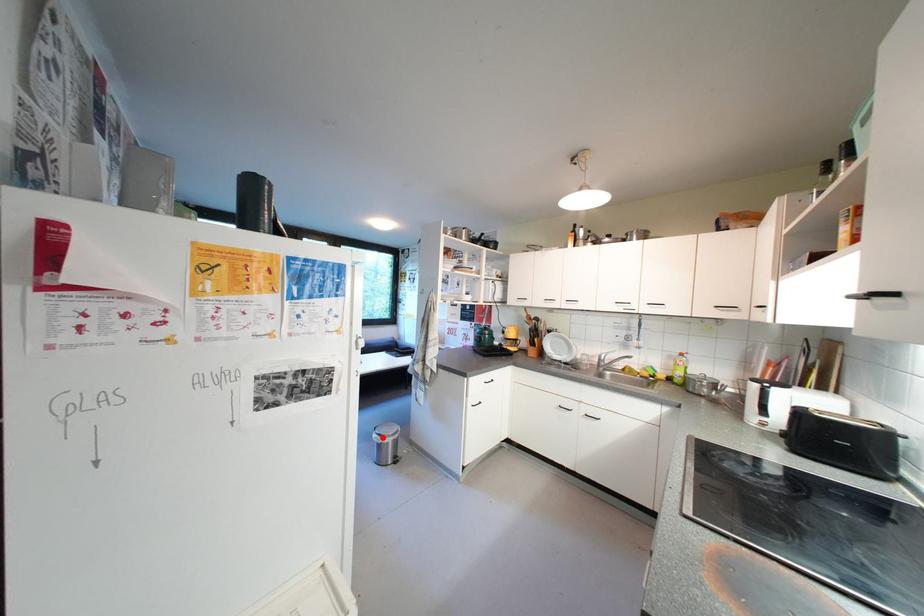
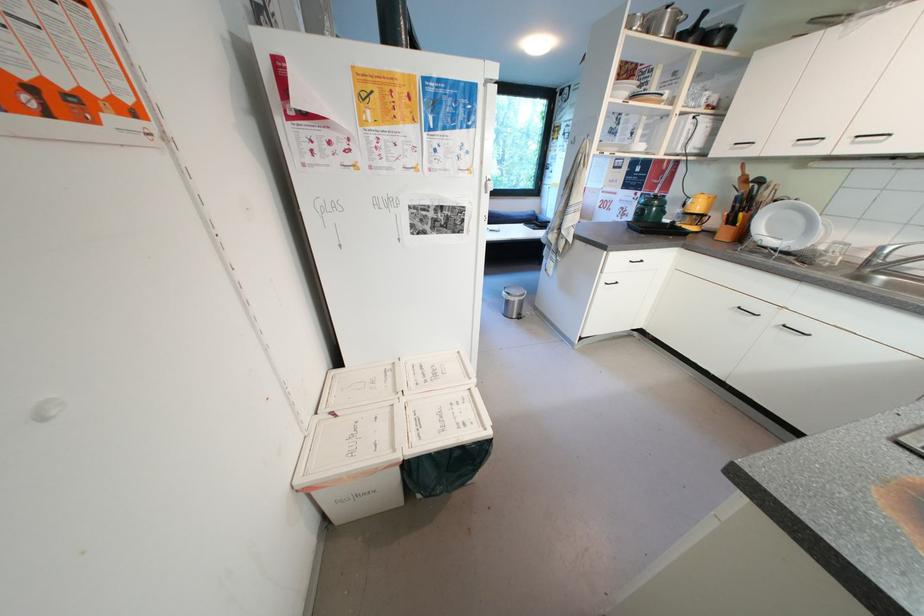
Question: A red point is marked in image1. In image2, is the corresponding 3D point closer to the camera or farther? Reply with the corresponding letter.

Choices:
 (A) The corresponding 3D point is closer.
 (B) The corresponding 3D point is farther.

Answer: (B)